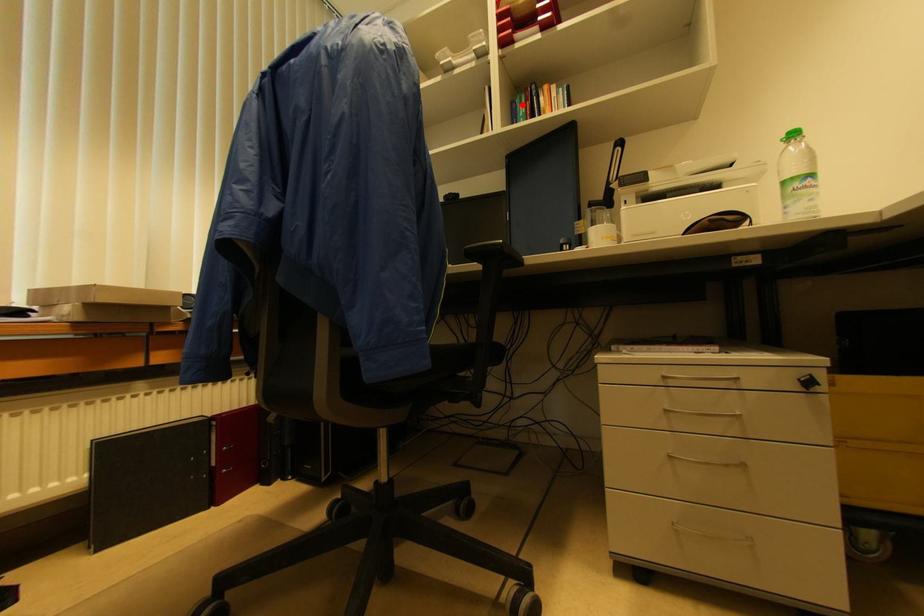
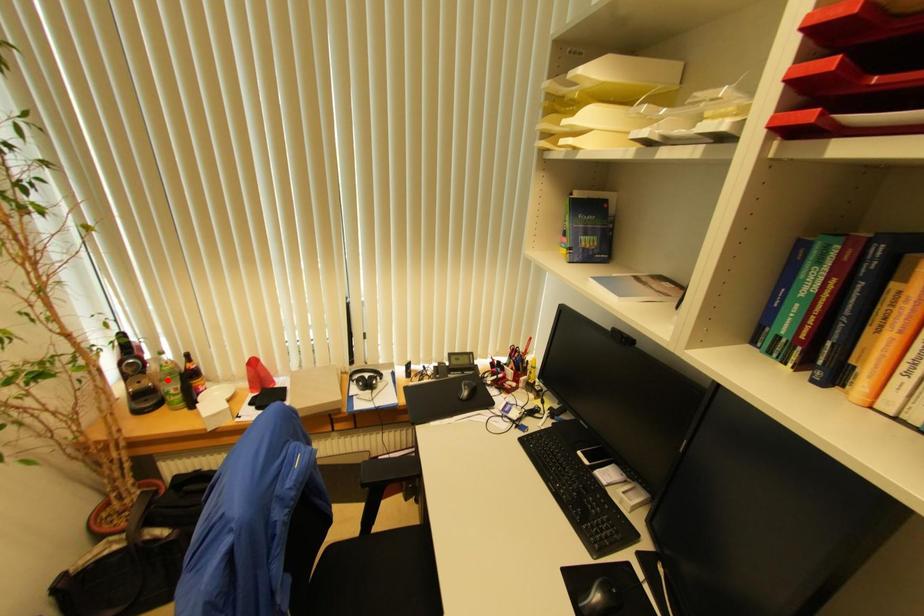
I am providing you with two images of the same scene from different viewpoints. A red point is marked on the first image and another point is marked on the second image. Do the highlighted points in image1 and image2 indicate the same real-world spot?

No